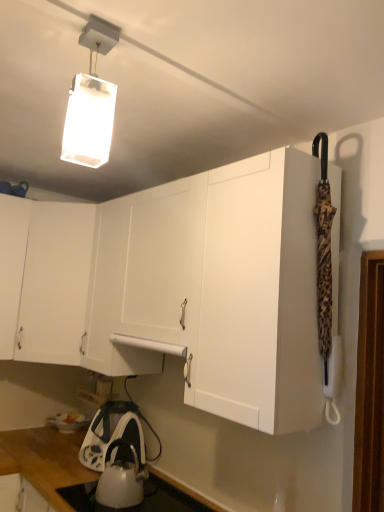
In order to click on blank area to the left of white glossy kettle at lower center in this screenshot , I will do `click(84, 500)`.